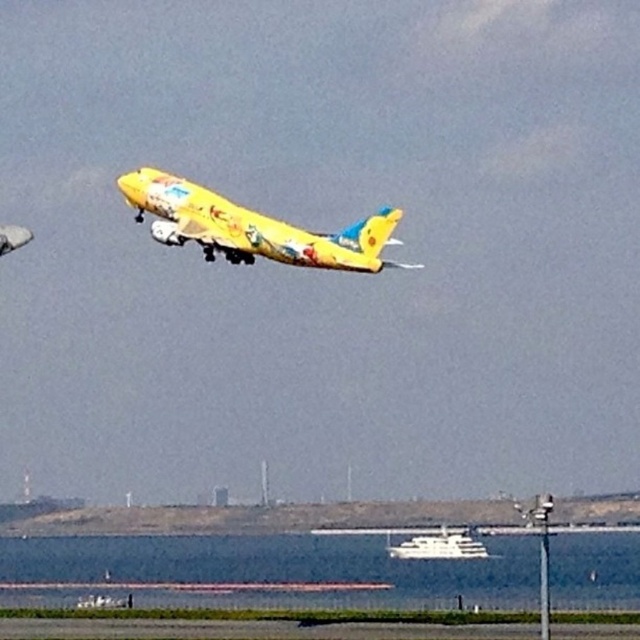
Question: Which object is positioned farthest from the transparent water at lower center?

Choices:
 (A) white glossy boat at lower center
 (B) yellow matte airplane at center

Answer: (B)

Question: Which point is farther to the camera?

Choices:
 (A) (278, 221)
 (B) (472, 545)
 (C) (8, 577)

Answer: (B)

Question: Is transparent water at lower center to the left of white glossy boat at lower center from the viewer's perspective?

Choices:
 (A) no
 (B) yes

Answer: (B)

Question: Is transparent water at lower center smaller than white glossy boat at lower center?

Choices:
 (A) yes
 (B) no

Answer: (B)

Question: Which point is farther from the camera taking this photo?

Choices:
 (A) (140, 172)
 (B) (401, 541)
 (C) (342, 600)

Answer: (B)

Question: Does transparent water at lower center have a greater width compared to white glossy boat at lower center?

Choices:
 (A) no
 (B) yes

Answer: (B)